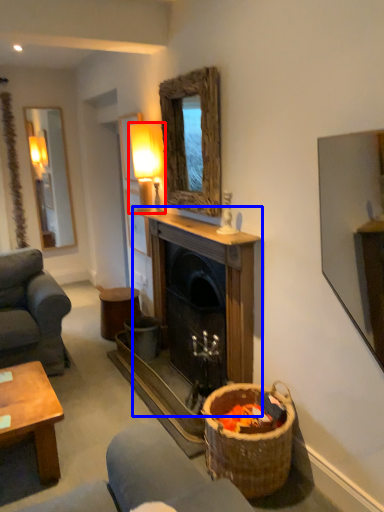
Question: Which point is further to the camera, lamp (highlighted by a red box) or fireplace (highlighted by a blue box)?

Choices:
 (A) lamp
 (B) fireplace

Answer: (A)